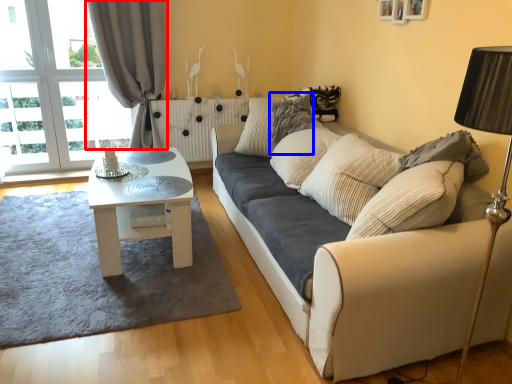
Question: Which object is closer to the camera taking this photo, curtain (highlighted by a red box) or pillow (highlighted by a blue box)?

Choices:
 (A) curtain
 (B) pillow

Answer: (B)